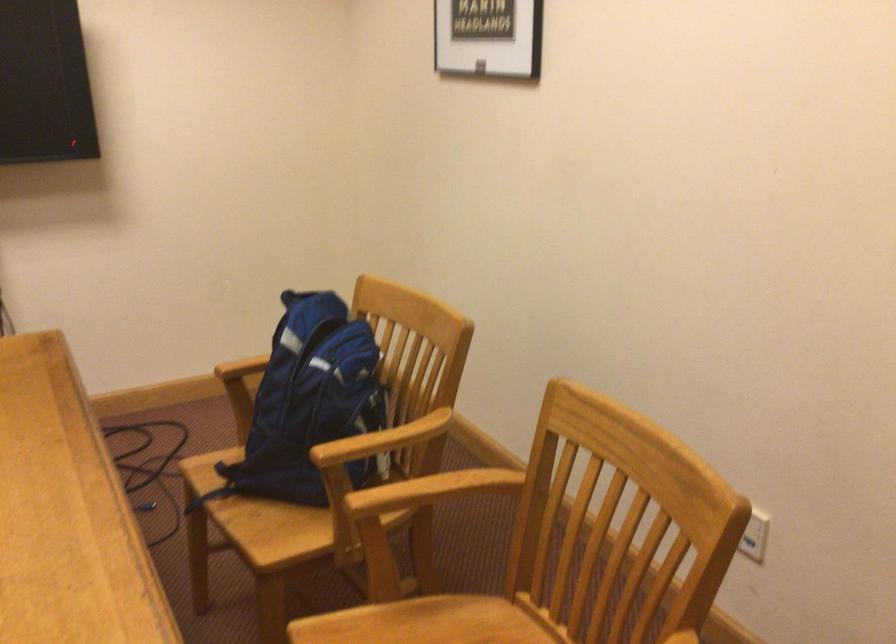
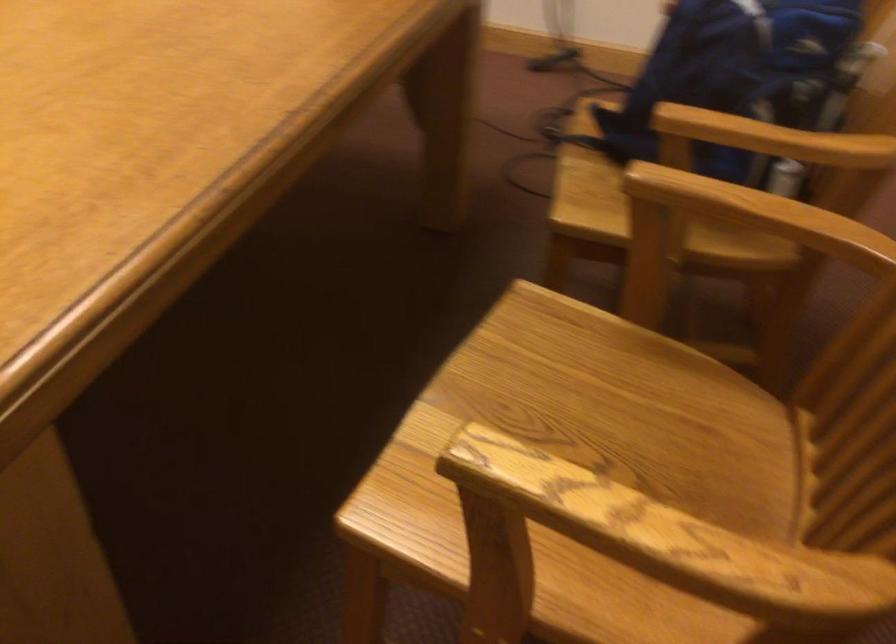
Find the pixel in the second image that matches (332,408) in the first image.

(736, 73)